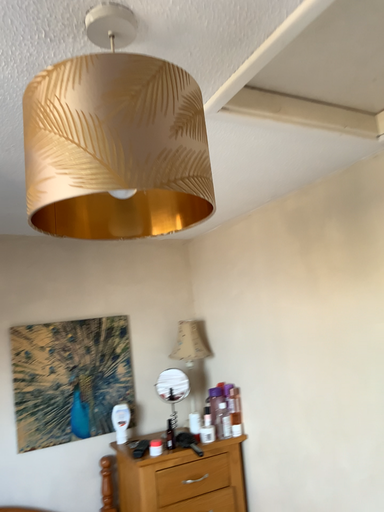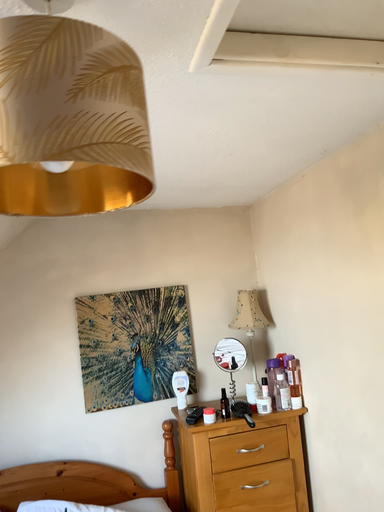
Question: How did the camera likely rotate when shooting the video?

Choices:
 (A) rotated left
 (B) rotated right

Answer: (A)